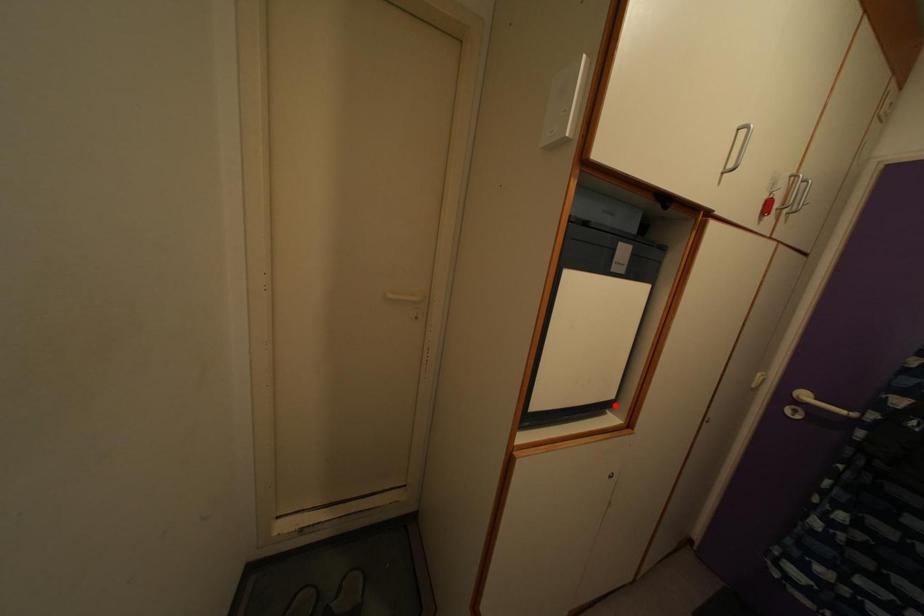
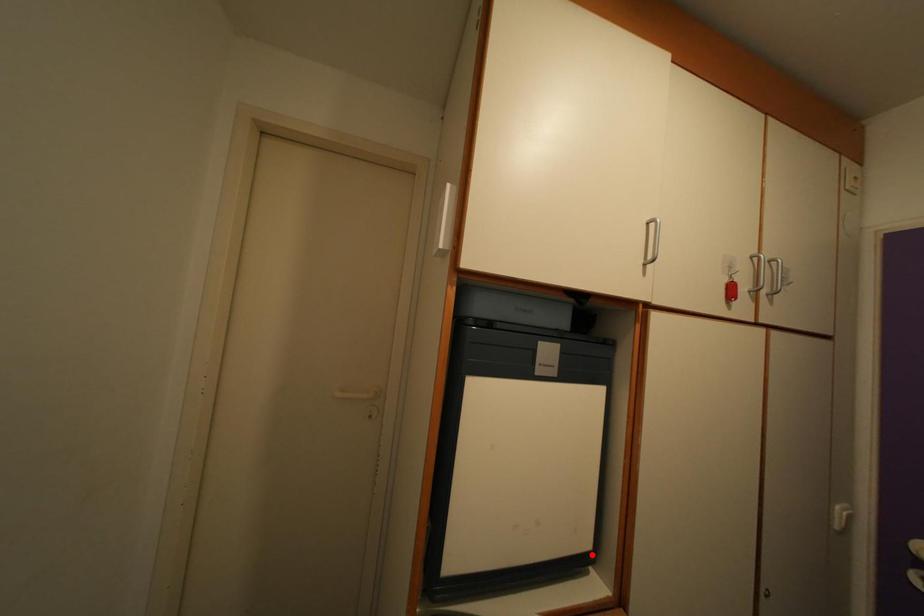
I am providing you with two images of the same scene from different viewpoints. A red point is marked on the first image and another point is marked on the second image. Do the highlighted points in image1 and image2 indicate the same real-world spot?

Yes